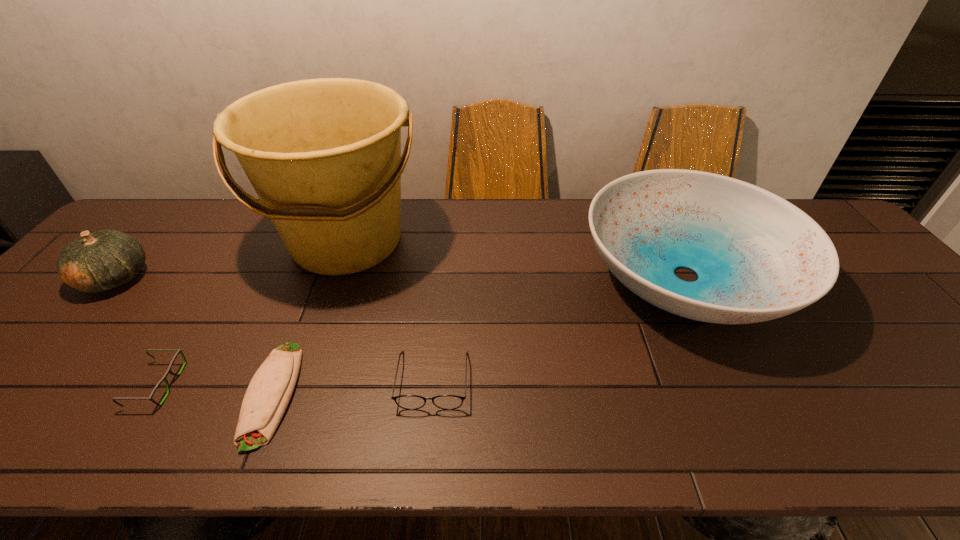
Where is `bucket`? The height and width of the screenshot is (540, 960). bucket is located at coordinates click(x=324, y=156).

At what (x,y) coordinates should I click in order to perform the action: click on dish. Please return your answer as a coordinate pair (x, y). Looking at the image, I should click on (758, 257).

This screenshot has height=540, width=960. Identify the location of the leftmost object. (95, 262).

You are a GUI agent. You are given a task and a screenshot of the screen. Output one action in this format:
    pyautogui.click(x=<x>, y=<y>)
    Task: Click on the taller spectacles
    The image size is (960, 540).
    Given the screenshot: What is the action you would take?
    pyautogui.click(x=410, y=402)

Where is `the right spectacles`? the right spectacles is located at coordinates pos(410,402).

Locate an element on the screen. This screenshot has width=960, height=540. the left spectacles is located at coordinates (168, 371).

Identify the location of the fifth object from right to left. The height and width of the screenshot is (540, 960). (168, 371).

The width and height of the screenshot is (960, 540). In order to click on burrito in this screenshot , I will do `click(268, 394)`.

Where is `free region located on the side of the tallest object with the handle`? Image resolution: width=960 pixels, height=540 pixels. free region located on the side of the tallest object with the handle is located at coordinates (288, 410).

Where is `vacant space located 0.140m on the front of the rightmost object`? This screenshot has width=960, height=540. vacant space located 0.140m on the front of the rightmost object is located at coordinates (756, 418).